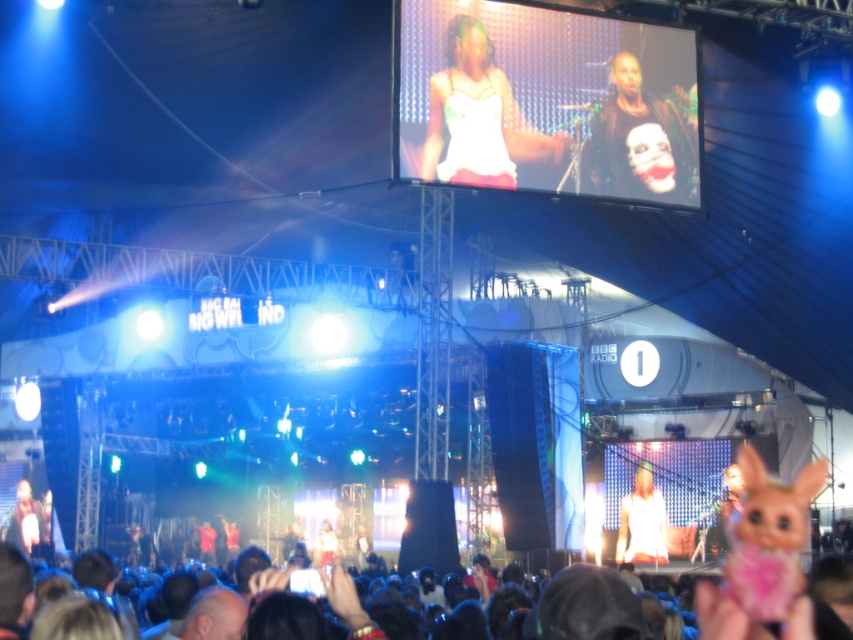
Question: Which object is positioned farthest from the white matte tank top at upper center?

Choices:
 (A) matte black screen at upper center
 (B) white matte shirt at center
 (C) matte black laptop at lower left
 (D) black leather jacket at upper center

Answer: (C)

Question: Is white matte tank top at upper center above matte black laptop at lower left?

Choices:
 (A) yes
 (B) no

Answer: (A)

Question: Which point is closer to the camera taking this photo?

Choices:
 (A) (431, 132)
 (B) (399, 8)
 (C) (267, 572)

Answer: (C)

Question: Considering the relative positions of dark brown hair at lower center and white matte shirt at center in the image provided, where is dark brown hair at lower center located with respect to white matte shirt at center?

Choices:
 (A) above
 (B) below

Answer: (A)

Question: Which point appears closest to the camera in this image?

Choices:
 (A) (646, 116)
 (B) (611, 182)
 (C) (32, 538)

Answer: (B)

Question: Does matte black screen at upper center have a larger size compared to matte black laptop at lower left?

Choices:
 (A) yes
 (B) no

Answer: (B)